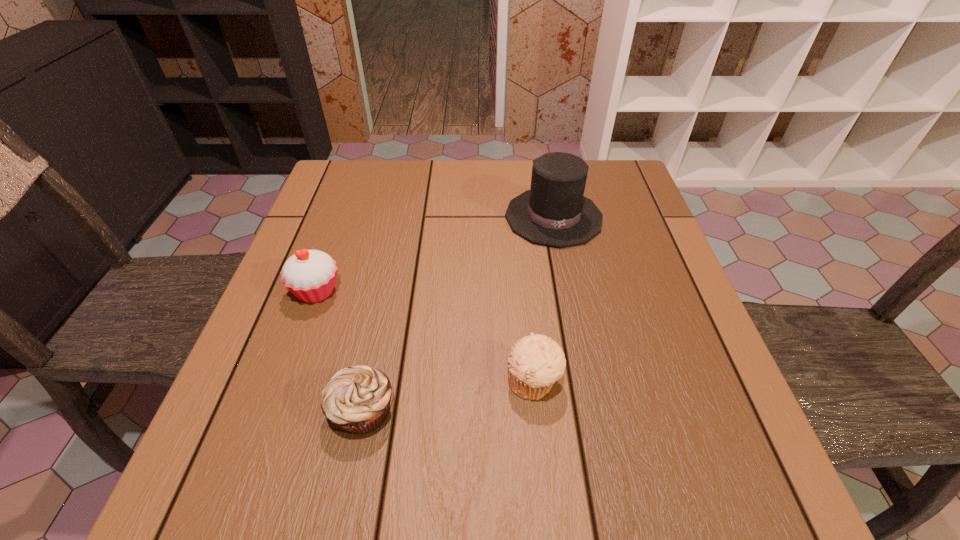
You are a GUI agent. You are given a task and a screenshot of the screen. Output one action in this format:
    pyautogui.click(x=<x>, y=<y>)
    Task: Click on the object that is at the far edge
    
    Given the screenshot: What is the action you would take?
    pyautogui.click(x=554, y=212)

Locate an element on the screen. object located at the left edge is located at coordinates (310, 275).

At what (x,y) coordinates should I click in order to perform the action: click on object that is positioned at the right edge. Please return your answer as a coordinate pair (x, y). This screenshot has width=960, height=540. Looking at the image, I should click on (554, 212).

Image resolution: width=960 pixels, height=540 pixels. Find the location of `object that is at the far right corner`. object that is at the far right corner is located at coordinates (554, 212).

Locate an element on the screen. The height and width of the screenshot is (540, 960). vacant space at the far edge of the desktop is located at coordinates (504, 176).

You are a GUI agent. You are given a task and a screenshot of the screen. Output one action in this format:
    pyautogui.click(x=<x>, y=<y>)
    Task: Click on the free space at the near edge of the desktop
    
    Given the screenshot: What is the action you would take?
    tap(583, 508)

At what (x,y) coordinates should I click in order to perform the action: click on vacant area at the left edge. Please return your answer as a coordinate pair (x, y). This screenshot has width=960, height=540. Looking at the image, I should click on (331, 334).

Image resolution: width=960 pixels, height=540 pixels. Identify the location of vacant space at the right edge. (597, 253).

The image size is (960, 540). Identify the location of vacant area at the far left corner of the desktop. pos(343,174).

In the image, there is a desktop. Where is `vacant space at the near left corner`? vacant space at the near left corner is located at coordinates (227, 489).